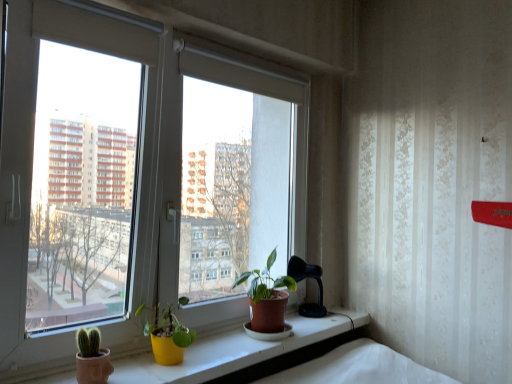
Where is `free spot above white plastic window at center (from a real-world perspective)`? free spot above white plastic window at center (from a real-world perspective) is located at coordinates (226, 41).